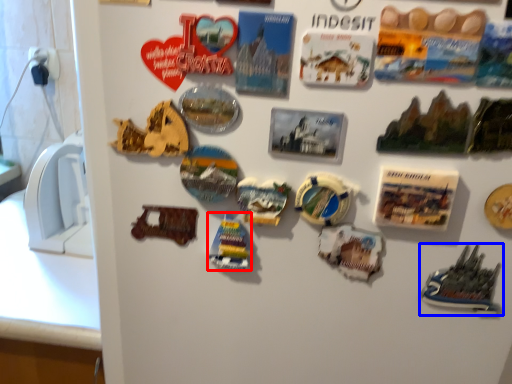
Question: Which of the following is the farthest to the observer, stuff (highlighted by a red box) or toy (highlighted by a blue box)?

Choices:
 (A) stuff
 (B) toy

Answer: (A)